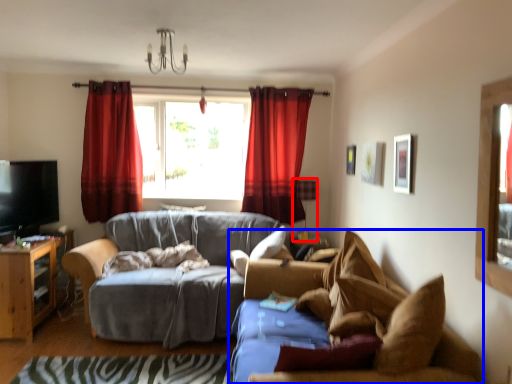
Question: Which object appears closest to the camera in this image, lamp (highlighted by a red box) or studio couch (highlighted by a blue box)?

Choices:
 (A) lamp
 (B) studio couch

Answer: (B)